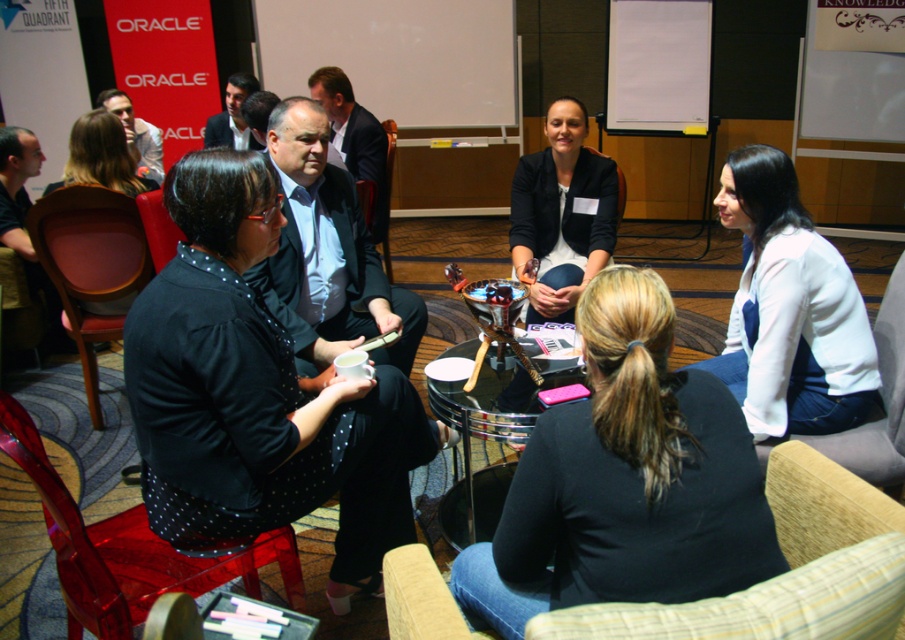
Question: Which object appears closest to the camera in this image?

Choices:
 (A) transparent glass table at center
 (B) matte black suit at upper center
 (C) transparent plastic armchair at lower left
 (D) dark blue blazer at center

Answer: (C)

Question: Does black fabric shirt at center have a greater width compared to matte black jacket at upper left?

Choices:
 (A) yes
 (B) no

Answer: (A)

Question: Can you confirm if pink leather armchair at lower left is thinner than matte black suit at center?

Choices:
 (A) no
 (B) yes

Answer: (B)

Question: Which of the following is the closest to the observer?

Choices:
 (A) dark blue blazer at center
 (B) matte black suit at center
 (C) transparent plastic armchair at lower left
 (D) matte black jacket at upper left

Answer: (C)

Question: Which of the following is the farthest from the observer?

Choices:
 (A) matte black suit at upper center
 (B) dark blue blazer at center

Answer: (A)

Question: Is black dotted shirt at left thinner than matte black jacket at upper left?

Choices:
 (A) yes
 (B) no

Answer: (B)